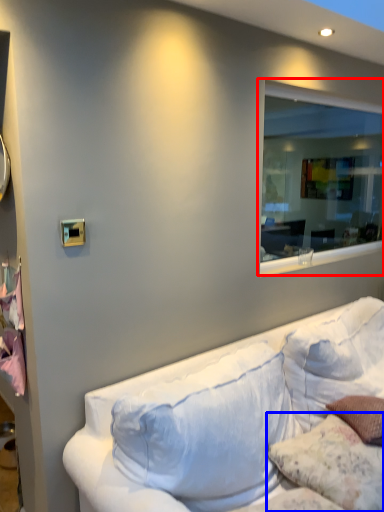
Question: Which point is further to the camera, window (highlighted by a red box) or pillow (highlighted by a blue box)?

Choices:
 (A) window
 (B) pillow

Answer: (A)